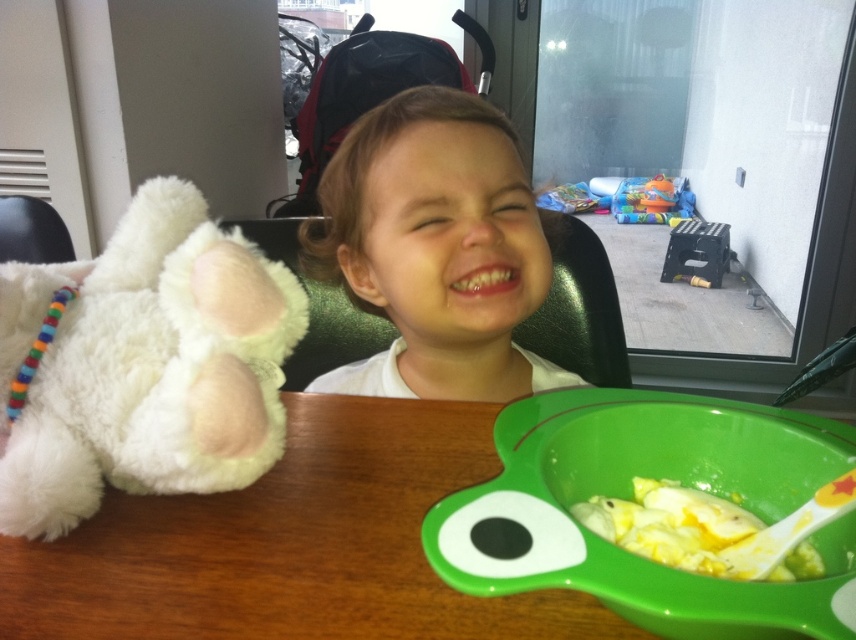
Question: Can you confirm if white fluffy teddy bear at left is positioned to the right of smooth skin child at center?

Choices:
 (A) no
 (B) yes

Answer: (A)

Question: Considering the real-world distances, which object is closest to the black plastic folding stool at lower right?

Choices:
 (A) yellow soft food at lower center
 (B) green plastic bowl at lower right
 (C) smooth skin child at center

Answer: (C)

Question: Is green plastic bowl at lower right wider than black plastic folding stool at lower right?

Choices:
 (A) no
 (B) yes

Answer: (A)

Question: Which of the following is the farthest from the observer?

Choices:
 (A) (664, 192)
 (B) (403, 305)
 (C) (777, 564)

Answer: (A)

Question: Estimate the real-world distances between objects in this image. Which object is farther from the black plastic folding stool at lower right?

Choices:
 (A) smooth skin child at center
 (B) yellow soft food at lower center

Answer: (B)

Question: Can you confirm if white fluffy teddy bear at left is positioned to the left of green plastic bowl at lower right?

Choices:
 (A) yes
 (B) no

Answer: (A)